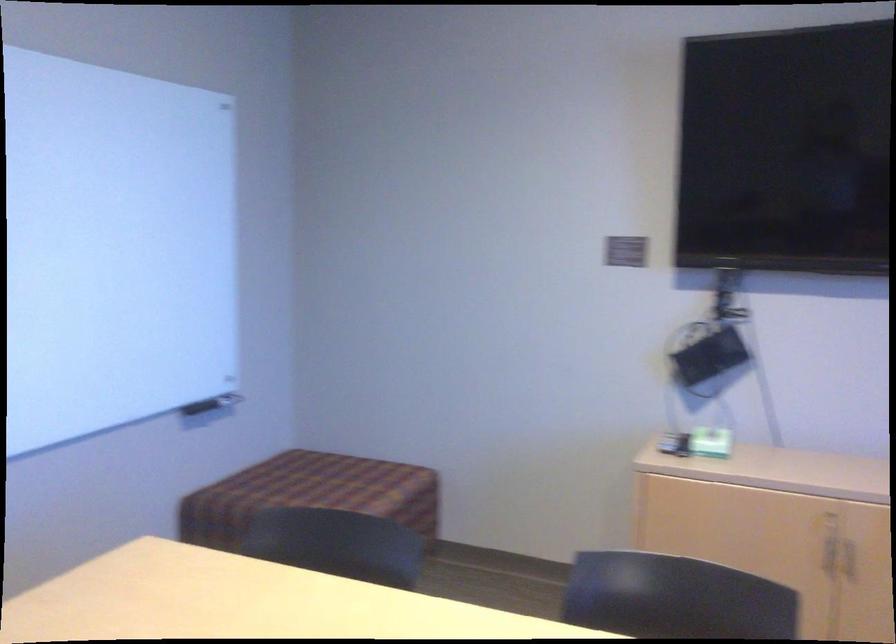
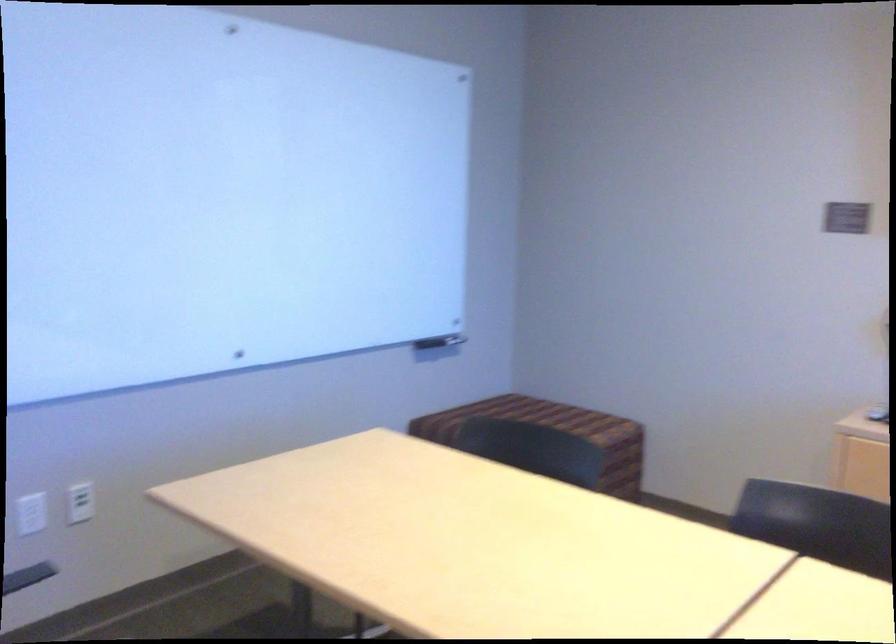
Question: How did the camera likely rotate?

Choices:
 (A) Left
 (B) Right
 (C) Up
 (D) Down

Answer: (A)